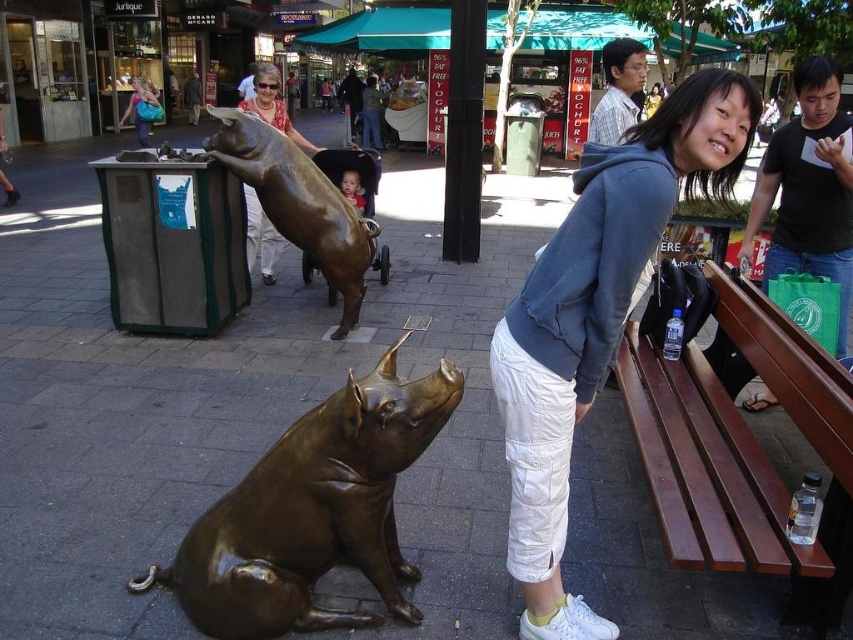
Is point (666, 166) closer to viewer compared to point (343, 198)?

Yes, point (666, 166) is in front of point (343, 198).

Looking at this image, is blue hoodie at center to the right of bronze statue at center from the viewer's perspective?

Correct, you'll find blue hoodie at center to the right of bronze statue at center.

Which is behind, point (703, 88) or point (349, 330)?

Positioned behind is point (349, 330).

Where is `blue hoodie at center`? The height and width of the screenshot is (640, 853). blue hoodie at center is located at coordinates (595, 317).

Is bronze statue at center behind brushed metal pig at upper center?

No, it is not.

Is bronze statue at center smaller than brushed metal pig at upper center?

Yes, bronze statue at center is smaller than brushed metal pig at upper center.

Locate an element on the screen. The width and height of the screenshot is (853, 640). bronze statue at center is located at coordinates (299, 202).

Is bronze statue at lower left smaller than brushed metal pig at upper center?

Yes.

Locate an element on the screen. The image size is (853, 640). bronze statue at lower left is located at coordinates (312, 512).

You are a GUI agent. You are given a task and a screenshot of the screen. Output one action in this format:
    pyautogui.click(x=<x>, y=<y>)
    Task: Click on the bronze statue at lower left
    Image resolution: width=853 pixels, height=640 pixels.
    Given the screenshot: What is the action you would take?
    pyautogui.click(x=312, y=512)